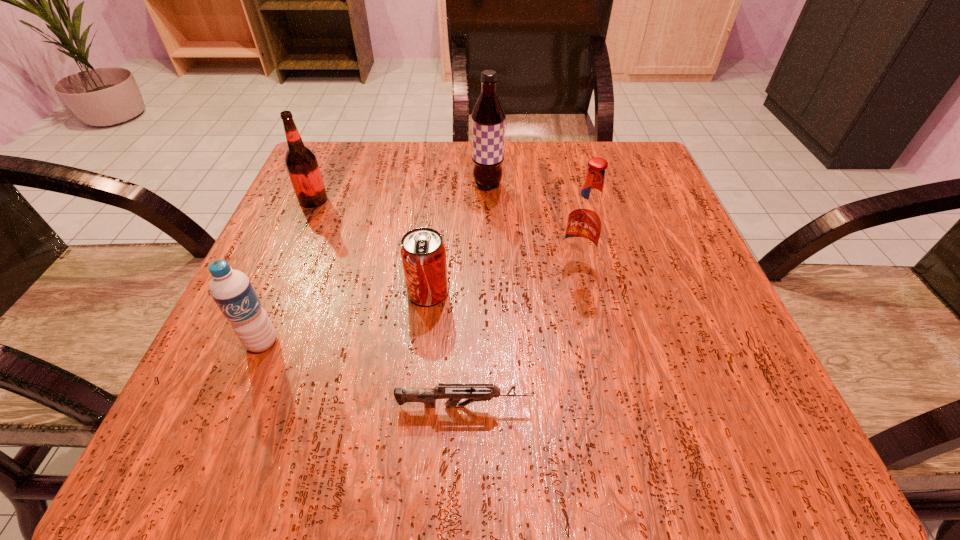
The height and width of the screenshot is (540, 960). Identify the location of root beer that is the closest to the second nearest object. (301, 163).

You are a GUI agent. You are given a task and a screenshot of the screen. Output one action in this format:
    pyautogui.click(x=<x>, y=<y>)
    Task: Click on the vacant area that satisfies the following two spatial constraints: 1. on the front side of the second root beer from right to left; 2. on the right side of the rightmost object
    This screenshot has height=540, width=960.
    Given the screenshot: What is the action you would take?
    [x=490, y=265]

Where is `vacant position in the image that satisfies the following two spatial constraints: 1. on the back side of the leftmost root beer; 2. on the right side of the second root beer from right to left`? vacant position in the image that satisfies the following two spatial constraints: 1. on the back side of the leftmost root beer; 2. on the right side of the second root beer from right to left is located at coordinates (320, 185).